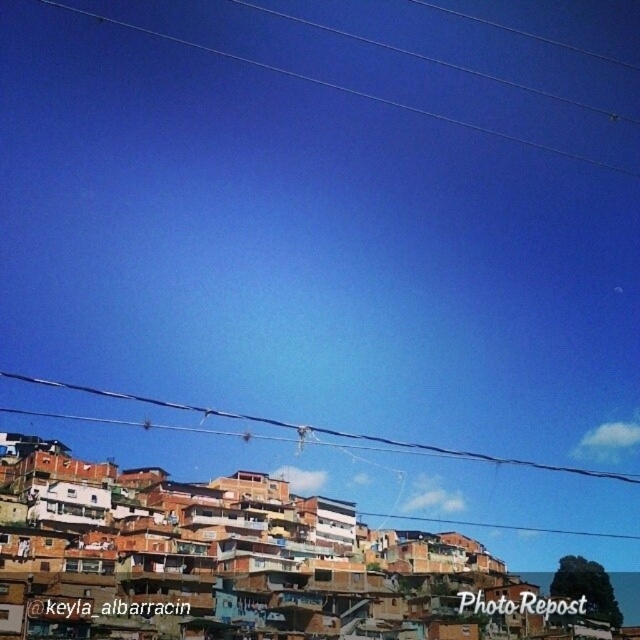
This screenshot has height=640, width=640. What do you see at coordinates (323, 429) in the screenshot?
I see `black wire at upper center` at bounding box center [323, 429].

Does black wire at upper center appear under clear plastic wires at upper center?

Indeed, black wire at upper center is positioned under clear plastic wires at upper center.

Is point (99, 390) farther from viewer compared to point (244, 56)?

No.

Where is `black wire at upper center`? black wire at upper center is located at coordinates (323, 429).

Which is below, brown wooden houses at lower center or black wire at upper center?

Positioned lower is brown wooden houses at lower center.

Does point (204, 483) come in front of point (442, 454)?

Yes, point (204, 483) is in front of point (442, 454).

Locate an element on the screen. The image size is (640, 640). brown wooden houses at lower center is located at coordinates (205, 545).

Who is positioned more to the left, brown wooden houses at lower center or clear plastic wires at upper center?

→ clear plastic wires at upper center

Can you confirm if brown wooden houses at lower center is bigger than clear plastic wires at upper center?

Yes, brown wooden houses at lower center is bigger than clear plastic wires at upper center.

What do you see at coordinates (205, 545) in the screenshot? I see `brown wooden houses at lower center` at bounding box center [205, 545].

The height and width of the screenshot is (640, 640). What are the coordinates of `brown wooden houses at lower center` in the screenshot? It's located at (205, 545).